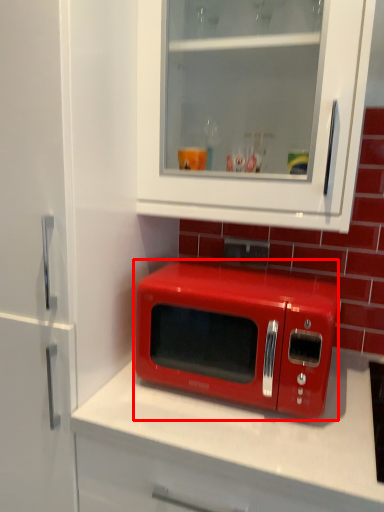
Question: In this image, where is microwave oven (annotated by the red box) located relative to cabinetry?

Choices:
 (A) right
 (B) left

Answer: (B)